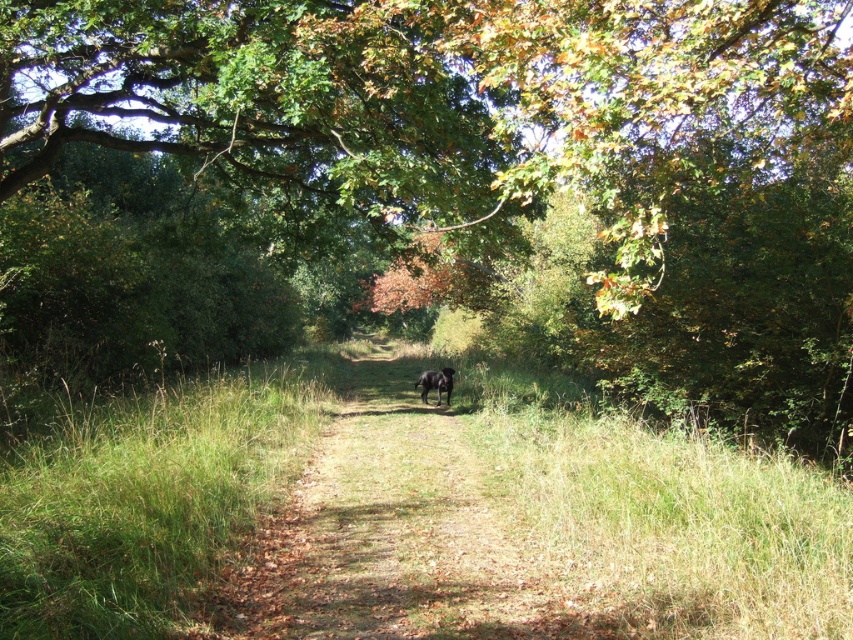
Is green grassy at left to the left of black fur dog at center from the viewer's perspective?

Correct, you'll find green grassy at left to the left of black fur dog at center.

Describe the element at coordinates (146, 497) in the screenshot. This screenshot has width=853, height=640. I see `green grassy at left` at that location.

This screenshot has width=853, height=640. In order to click on green grassy at left in this screenshot , I will do pyautogui.click(x=146, y=497).

In the scene shown: Is green leafy tree at center bigger than black fur dog at center?

Indeed, green leafy tree at center has a larger size compared to black fur dog at center.

Who is positioned more to the left, green leafy tree at center or black fur dog at center?

green leafy tree at center

Between point (683, 244) and point (440, 392), which one is positioned in front?

Point (683, 244) is in front.

Locate an element on the screen. green leafy tree at center is located at coordinates (514, 156).

Is green leafy tree at center thinner than green grassy at left?

No, green leafy tree at center is not thinner than green grassy at left.

Between green leafy tree at center and green grassy at left, which one has more height?

green leafy tree at center

Describe the element at coordinates (514, 156) in the screenshot. Image resolution: width=853 pixels, height=640 pixels. I see `green leafy tree at center` at that location.

At what (x,y) coordinates should I click in order to perform the action: click on green leafy tree at center. Please return your answer as a coordinate pair (x, y). This screenshot has height=640, width=853. Looking at the image, I should click on (514, 156).